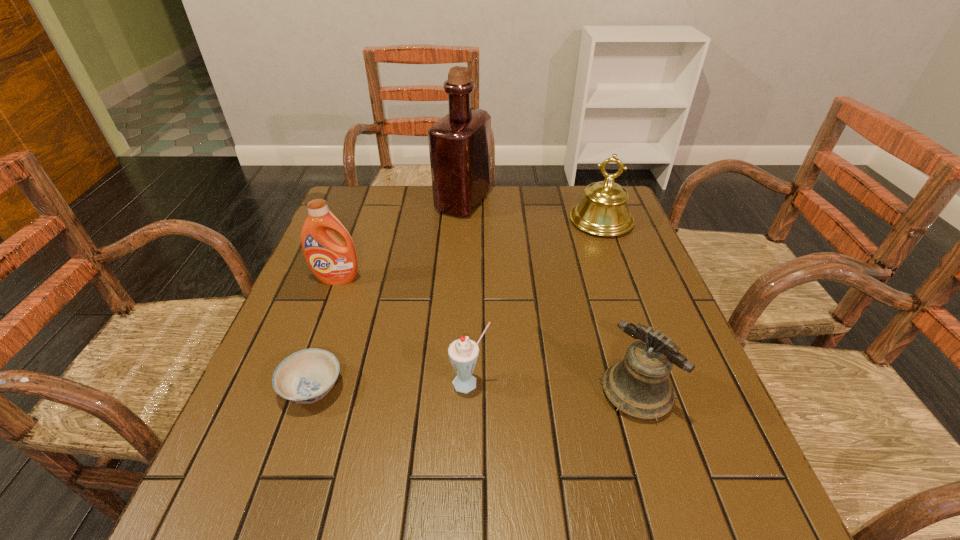
Where is `the tallest object`? Image resolution: width=960 pixels, height=540 pixels. the tallest object is located at coordinates (459, 144).

The width and height of the screenshot is (960, 540). What are the coordinates of `detergent` in the screenshot? It's located at (333, 262).

Find the location of a particular element. This screenshot has height=540, width=960. the farther bell is located at coordinates (603, 211).

Locate an element on the screen. Image resolution: width=960 pixels, height=540 pixels. the shorter bell is located at coordinates (639, 386).

Where is `milkshake`? The width and height of the screenshot is (960, 540). milkshake is located at coordinates (463, 353).

This screenshot has height=540, width=960. I want to click on bowl, so click(x=306, y=376).

This screenshot has height=540, width=960. I want to click on free spot located on the front of the liquor, so click(x=460, y=243).

The image size is (960, 540). I want to click on blank space located on the front-facing side of the detergent, so click(297, 387).

Find the location of `vacant region located 0.120m on the front of the taller bell`. vacant region located 0.120m on the front of the taller bell is located at coordinates (618, 267).

Identify the location of vacant area located 0.320m on the back of the shorter bell. (597, 265).